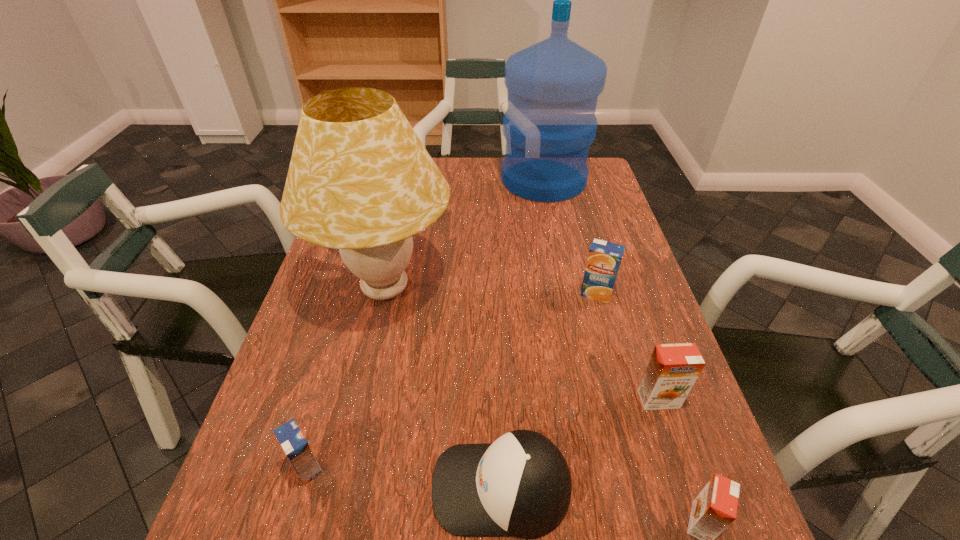
Locate an element on the screen. This screenshot has height=540, width=960. orange_juice that is at the left edge is located at coordinates (293, 442).

Find the location of a particular element. water jug that is at the right edge is located at coordinates (553, 86).

The image size is (960, 540). Find the location of `object that is positioned at the far right corner`. object that is positioned at the far right corner is located at coordinates (553, 86).

Where is `free point at the far edge`? free point at the far edge is located at coordinates (498, 170).

What are the coordinates of `free space at the left edge of the desktop` in the screenshot? It's located at (300, 344).

Locate an element on the screen. Image resolution: width=960 pixels, height=540 pixels. free spot at the right edge of the desktop is located at coordinates (697, 455).

Where is `vacant space in between the smaller blue orange_juice and the yellow lampshade`? vacant space in between the smaller blue orange_juice and the yellow lampshade is located at coordinates (347, 378).

Find the location of a particular element. The image size is (960, 540). unoccupied position between the right blue orange_juice and the nearer blue orange_juice is located at coordinates [452, 380].

The height and width of the screenshot is (540, 960). Find the location of `free space that is in between the smaller blue orange_juice and the gray cap`. free space that is in between the smaller blue orange_juice and the gray cap is located at coordinates (404, 477).

Where is `empty space between the farther orange orange juice and the cap`? This screenshot has height=540, width=960. empty space between the farther orange orange juice and the cap is located at coordinates point(580,443).